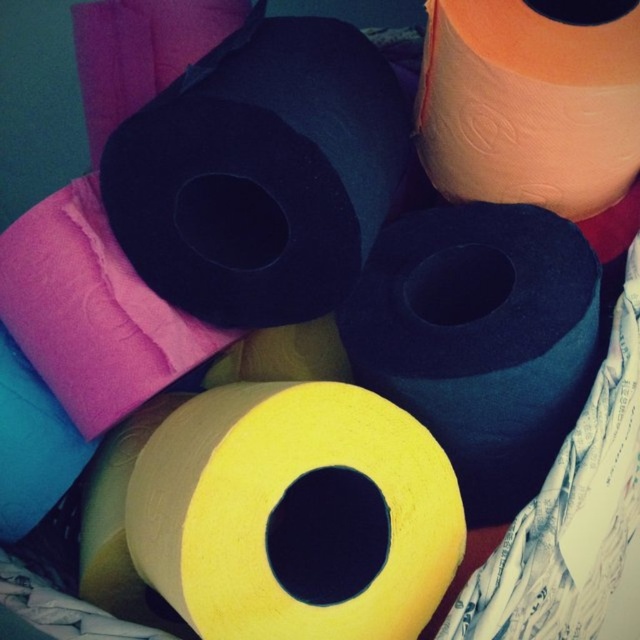
You are organizing a storage area and need to move items from the orange matte paper towel at upper right to the matte pink pillow at upper left. Which item is closer to you as you stand in front of the storage area?

The orange matte paper towel at upper right is closer to you since it is in front of the matte pink pillow at upper left.

You are standing in front of a stack of toilet paper rolls. You notice a specific point at coordinates point (x=212, y=592). If you want to reach that point with your hand, will you be able to touch it without moving your body?

The distance between point (x=212, y=592) and the viewer is 30.01 inches. Since the average human arm length is about 25 to 30 inches, you might just barely reach it or need to stretch slightly to touch point (x=212, y=592).